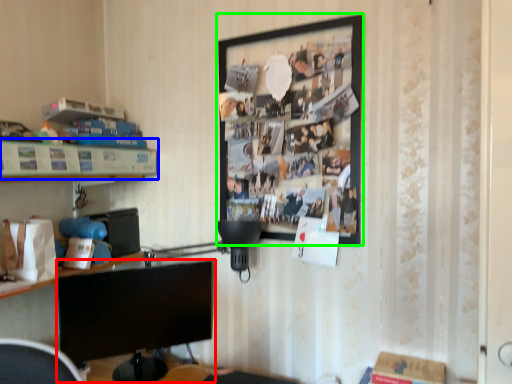
Question: Which is nearer to the computer monitor (highlighted by a red box)? shelf (highlighted by a blue box) or picture frame (highlighted by a green box).

Choices:
 (A) shelf
 (B) picture frame

Answer: (A)